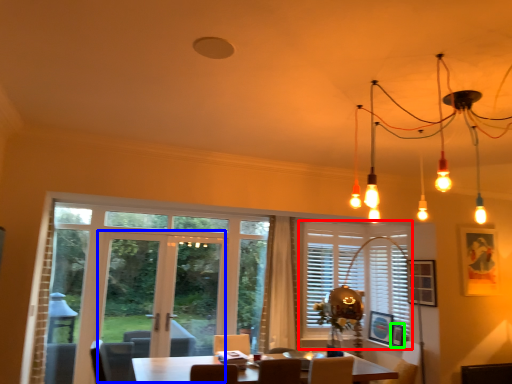
Question: Estimate the real-world distances between objects in this image. Which object is closer to window (highlighted by a red box), screen door (highlighted by a blue box) or picture frame (highlighted by a green box)?

Choices:
 (A) screen door
 (B) picture frame

Answer: (B)